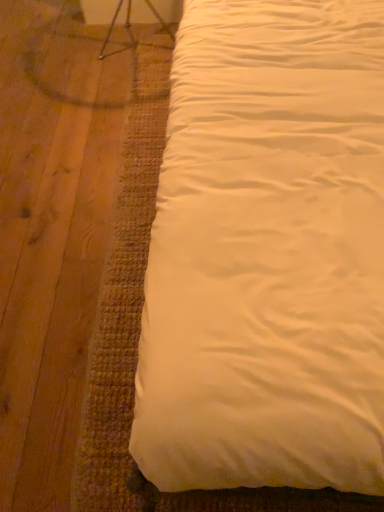
Question: From the image's perspective, is white satin bed at upper right above or below metallic silver swivel chair at upper left?

Choices:
 (A) above
 (B) below

Answer: (B)

Question: Is white satin bed at upper right wider or thinner than metallic silver swivel chair at upper left?

Choices:
 (A) wide
 (B) thin

Answer: (A)

Question: From a real-world perspective, is white satin bed at upper right physically located above or below metallic silver swivel chair at upper left?

Choices:
 (A) below
 (B) above

Answer: (B)

Question: Is metallic silver swivel chair at upper left to the left or to the right of white satin bed at upper right in the image?

Choices:
 (A) right
 (B) left

Answer: (B)

Question: Is point [132, 38] closer or farther from the camera than point [203, 266]?

Choices:
 (A) closer
 (B) farther

Answer: (B)

Question: From a real-world perspective, is metallic silver swivel chair at upper left physically located above or below white satin bed at upper right?

Choices:
 (A) above
 (B) below

Answer: (B)

Question: Is metallic silver swivel chair at upper left inside the boundaries of white satin bed at upper right, or outside?

Choices:
 (A) outside
 (B) inside

Answer: (A)